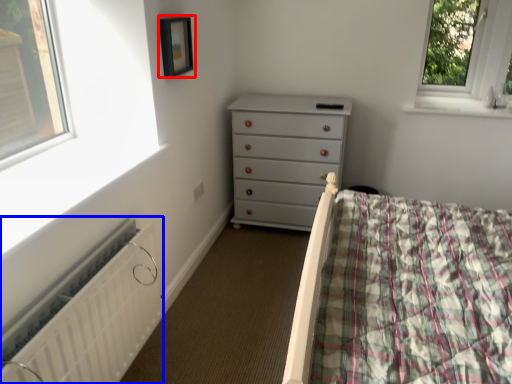
Question: Which point is further to the camera, picture frame (highlighted by a red box) or radiator (highlighted by a blue box)?

Choices:
 (A) picture frame
 (B) radiator

Answer: (A)